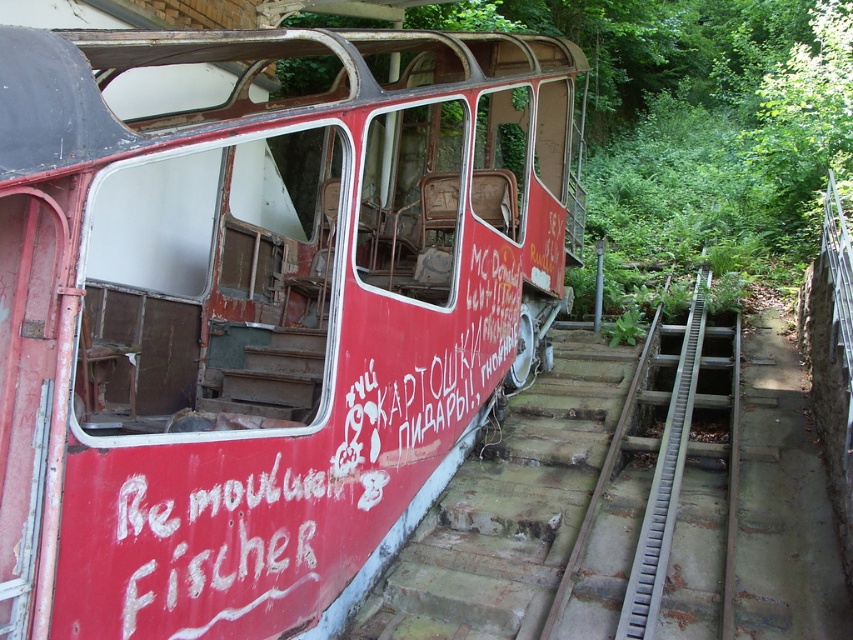
Is rusty metal train at center positioned at the back of concrete stairs at center?

Yes, it is.

Between rusty metal train at center and concrete stairs at center, which one is positioned higher?

Positioned higher is rusty metal train at center.

Locate an element on the screen. rusty metal train at center is located at coordinates (257, 310).

The image size is (853, 640). Identify the location of rusty metal train at center. (257, 310).

Consider the image. Does rusty metal train at center appear on the left side of gray metallic train track at center?

Indeed, rusty metal train at center is positioned on the left side of gray metallic train track at center.

Which is behind, point (447, 356) or point (688, 616)?

The point (447, 356) is more distant.

In order to click on rusty metal train at center in this screenshot , I will do `click(257, 310)`.

Who is more distant from viewer, (694,365) or (639,532)?

Positioned behind is point (694,365).

From the picture: Who is taller, gray metallic train track at center or metallic gray rail at right?

Standing taller between the two is gray metallic train track at center.

Find the location of a particular element. This screenshot has height=640, width=853. gray metallic train track at center is located at coordinates (666, 493).

The width and height of the screenshot is (853, 640). Find the location of `gray metallic train track at center`. gray metallic train track at center is located at coordinates (666, 493).